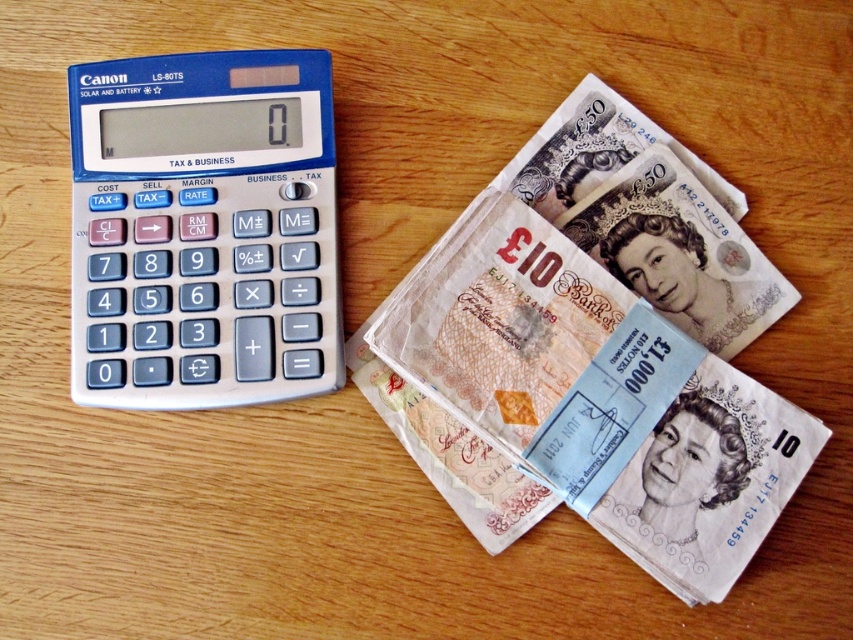
This screenshot has width=853, height=640. I want to click on smooth paper £10 notes at center, so click(598, 355).

Is point (728, 442) closer to camera compared to point (334, 253)?

Yes.

Locate an element on the screen. The image size is (853, 640). smooth paper £10 notes at center is located at coordinates (598, 355).